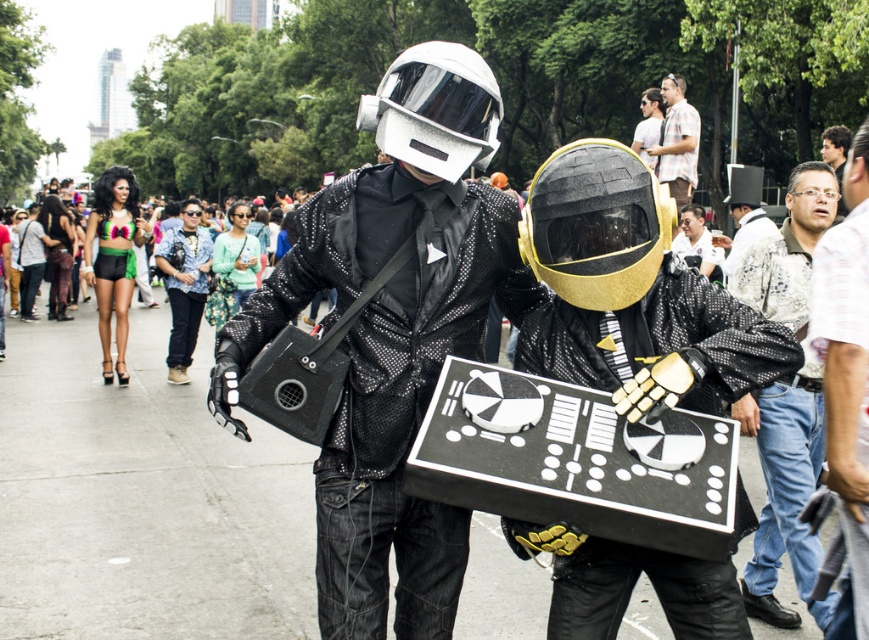
Find the location of a particular element. This screenshot has width=869, height=640. green shiny shorts at center is located at coordinates (184, 288).

Which is behind, point (198, 216) or point (850, 134)?

Point (198, 216)

In order to click on green shiny shorts at center in this screenshot , I will do `click(184, 288)`.

Who is shorter, light brown leather jacket at right or green shiny shorts at center?

green shiny shorts at center is shorter.

Between light brown leather jacket at right and green shiny shorts at center, which one is positioned higher?

green shiny shorts at center is above.

The width and height of the screenshot is (869, 640). I want to click on light brown leather jacket at right, so click(787, 400).

Is point (775, 417) positioned behind point (751, 237)?

No, (775, 417) is closer to viewer.

Which is above, light brown leather jacket at right or white textured top hat at upper center?

Positioned higher is white textured top hat at upper center.

Locate an element on the screen. light brown leather jacket at right is located at coordinates (787, 400).

Where is `light brown leather jacket at right`? light brown leather jacket at right is located at coordinates (787, 400).